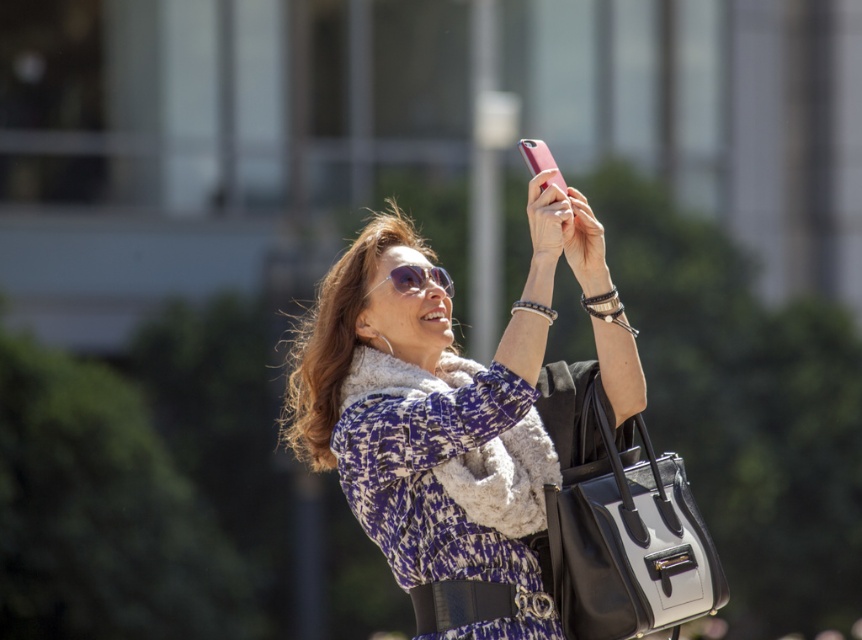
You are a photographer trying to capture a closeup of the shiny silver sunglasses at center without the black leather handbag at lower right appearing in the frame. Given that your camera has a focal length of 50mm and a sensor size of 24x36mm, can you estimate whether the handbag will be visible in the photo? Explain your reasoning based on the distance provided.

The distance between the black leather handbag at lower right and shiny silver sunglasses at center is 1.96 meters. With a 50mm lens and a sensor size of 24x36mm, the field of view is approximately 46 degrees horizontally. If the sunglasses are centered in the frame, the handbag at 1.96 meters away would likely fall outside the frame unless the photographer is positioned extremely close to the subject. Therefore, the handbag should not appear in the photo.

You are a photographer trying to capture the woman in the scene. You need to focus on the matte black jacket at center and the black leather handbag at lower right. Which object should you adjust your focus to first if you want to ensure both are in sharp focus?

The matte black jacket at center is positioned over the black leather handbag at lower right, so you should focus on the matte black jacket at center first to ensure both are in sharp focus.